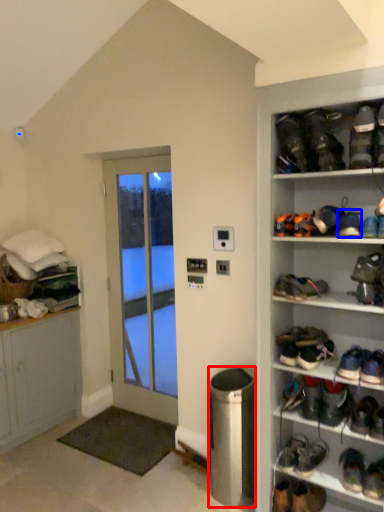
Question: Which of the following is the farthest to the observer, trash bin/can (highlighted by a red box) or footwear (highlighted by a blue box)?

Choices:
 (A) trash bin/can
 (B) footwear

Answer: (A)